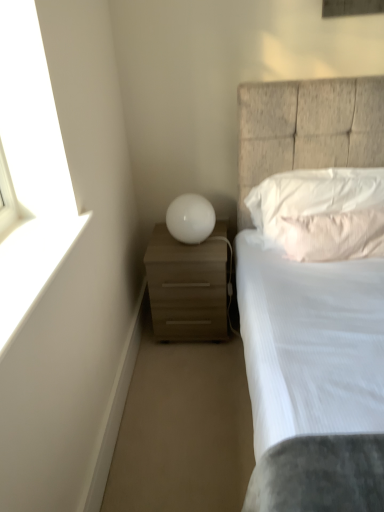
Image resolution: width=384 pixels, height=512 pixels. I want to click on free space on the front side of matte wood nightstand at lower left, so click(190, 371).